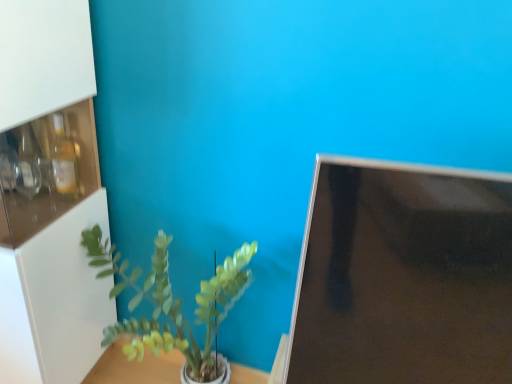
Question: Is white glossy cabinet at left positioned in front of white glossy table at center?

Choices:
 (A) yes
 (B) no

Answer: (A)

Question: Is white glossy table at center at the back of white glossy cabinet at left?

Choices:
 (A) no
 (B) yes

Answer: (A)

Question: From a real-world perspective, is white glossy cabinet at left positioned under white glossy table at center based on gravity?

Choices:
 (A) yes
 (B) no

Answer: (B)

Question: From the image's perspective, is white glossy cabinet at left under white glossy table at center?

Choices:
 (A) no
 (B) yes

Answer: (A)

Question: Is white glossy cabinet at left shorter than white glossy table at center?

Choices:
 (A) no
 (B) yes

Answer: (A)

Question: Looking at their shapes, would you say white glossy table at center is wider or thinner than white glossy cabinet at left?

Choices:
 (A) thin
 (B) wide

Answer: (A)

Question: Does point (166, 370) appear closer or farther from the camera than point (48, 31)?

Choices:
 (A) farther
 (B) closer

Answer: (A)

Question: Do you think white glossy table at center is within white glossy cabinet at left, or outside of it?

Choices:
 (A) outside
 (B) inside

Answer: (A)

Question: From the image's perspective, is white glossy table at center above or below white glossy cabinet at left?

Choices:
 (A) below
 (B) above

Answer: (A)

Question: From their relative heights in the image, would you say white glossy cabinet at left is taller or shorter than green matte plant at center?

Choices:
 (A) tall
 (B) short

Answer: (A)

Question: From a real-world perspective, relative to green matte plant at center, is white glossy cabinet at left vertically above or below?

Choices:
 (A) above
 (B) below

Answer: (A)

Question: In the image, is white glossy cabinet at left on the left side or the right side of green matte plant at center?

Choices:
 (A) left
 (B) right

Answer: (A)

Question: Is white glossy cabinet at left inside or outside of green matte plant at center?

Choices:
 (A) inside
 (B) outside

Answer: (B)

Question: In the image, is white glossy cabinet at left positioned in front of or behind black glossy monitor at right?

Choices:
 (A) behind
 (B) front

Answer: (A)

Question: In terms of width, does white glossy cabinet at left look wider or thinner when compared to black glossy monitor at right?

Choices:
 (A) wide
 (B) thin

Answer: (A)